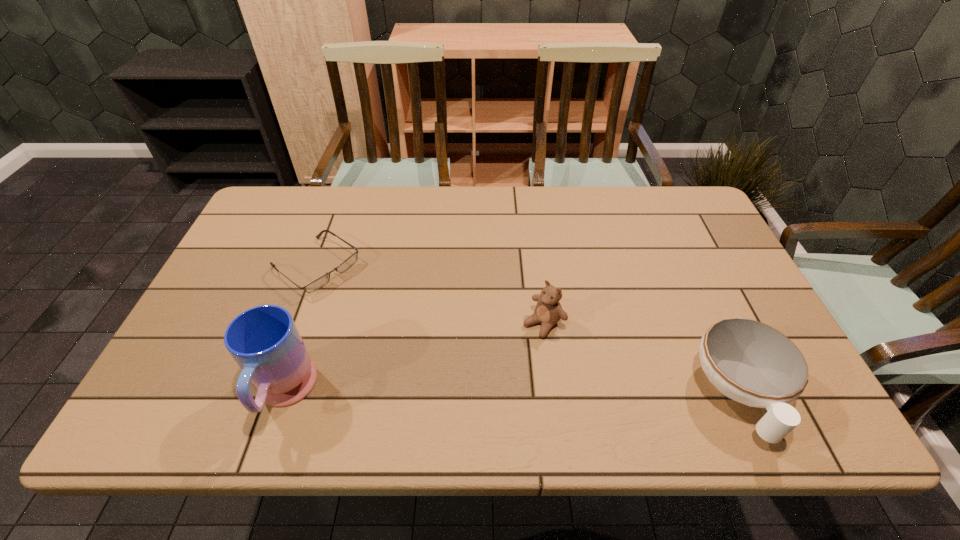
This screenshot has width=960, height=540. I want to click on vacant area that lies between the spectacles and the rightmost object, so click(527, 330).

Locate an element on the screen. The height and width of the screenshot is (540, 960). object that ranks as the second closest to the spectacles is located at coordinates (548, 311).

Choose which object is the second nearest neighbor to the third object from left to right. Please provide its 2D coordinates. Your answer should be formatted as a tuple, i.e. [(x, y)], where the tuple contains the x and y coordinates of a point satisfying the conditions above.

[(323, 280)]